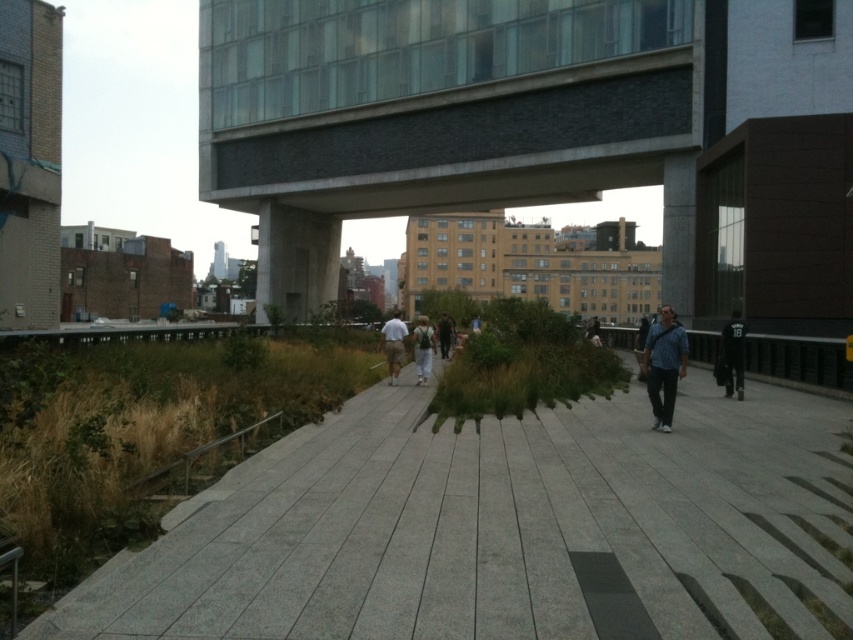
Who is lower down, glass concrete bridge at upper center or light gray fabric jacket at center?

light gray fabric jacket at center is lower down.

Identify the location of glass concrete bridge at upper center. The width and height of the screenshot is (853, 640). (460, 161).

Can you confirm if glass concrete bridge at upper center is positioned to the right of dark brown leather jacket at center?

Correct, you'll find glass concrete bridge at upper center to the right of dark brown leather jacket at center.

The height and width of the screenshot is (640, 853). Describe the element at coordinates (460, 161) in the screenshot. I see `glass concrete bridge at upper center` at that location.

Is point (500, 170) positioned behind point (451, 342)?

Yes.

Identify the location of glass concrete bridge at upper center. (460, 161).

Between light blue shirt at center and light gray fabric jacket at center, which one is positioned higher?

light blue shirt at center is above.

In the scene shown: Does light blue shirt at center lie behind light gray fabric jacket at center?

No.

What do you see at coordinates (393, 346) in the screenshot? I see `light blue shirt at center` at bounding box center [393, 346].

What are the coordinates of `light blue shirt at center` in the screenshot? It's located at (393, 346).